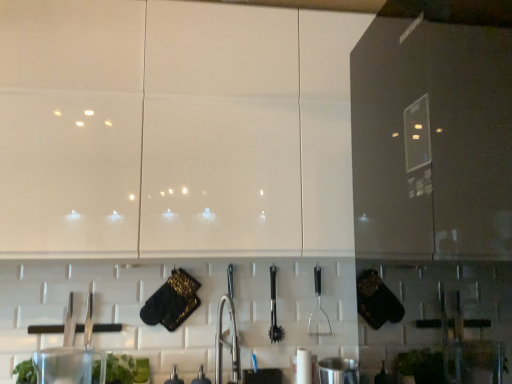
Identify the location of metallic faucet at center, the 2th appliance when ordered from right to left. (201, 377).

The width and height of the screenshot is (512, 384). What do you see at coordinates (201, 377) in the screenshot?
I see `metallic faucet at center, the third appliance from the left` at bounding box center [201, 377].

What do you see at coordinates (70, 365) in the screenshot? I see `transparent plastic container at lower left, the 4th appliance viewed from the right` at bounding box center [70, 365].

The width and height of the screenshot is (512, 384). What do you see at coordinates (183, 128) in the screenshot? I see `white glossy cabinet at upper center` at bounding box center [183, 128].

Describe the element at coordinates (338, 371) in the screenshot. I see `stainless steel pot at lower center, the 1th appliance viewed from the right` at that location.

The image size is (512, 384). What do you see at coordinates (319, 311) in the screenshot?
I see `black plastic spatula at center-right, the 2th silverware viewed from the left` at bounding box center [319, 311].

What do you see at coordinates (174, 377) in the screenshot?
I see `metallic silver faucet at center, the 2th appliance in the left-to-right sequence` at bounding box center [174, 377].

Image resolution: width=512 pixels, height=384 pixels. Identify the location of metallic faucet at center, the 2th appliance when ordered from right to left. (201, 377).

Is metallic silver faucet at center, arranged as the 3th appliance when viewed from the right, outside of stainless steel pot at lower center, the 1th appliance viewed from the right?

That's correct, metallic silver faucet at center, arranged as the 3th appliance when viewed from the right, is outside of stainless steel pot at lower center, the 1th appliance viewed from the right.

How many degrees apart are the facing directions of metallic silver faucet at center, arranged as the 3th appliance when viewed from the right, and stainless steel pot at lower center, which ranks as the 4th appliance in left-to-right order?

8.95 degrees separate the facing orientations of metallic silver faucet at center, arranged as the 3th appliance when viewed from the right, and stainless steel pot at lower center, which ranks as the 4th appliance in left-to-right order.

From the image's perspective, is metallic silver faucet at center, arranged as the 3th appliance when viewed from the right, above or below stainless steel pot at lower center, which ranks as the 4th appliance in left-to-right order?

metallic silver faucet at center, arranged as the 3th appliance when viewed from the right, is below stainless steel pot at lower center, which ranks as the 4th appliance in left-to-right order.

Based on the photo, is metallic silver faucet at center, arranged as the 3th appliance when viewed from the right, wider than stainless steel pot at lower center, which ranks as the 4th appliance in left-to-right order?

No.

Is metallic faucet at center, the 2th appliance when ordered from right to left, touching white glossy cabinet at upper center?

No, metallic faucet at center, the 2th appliance when ordered from right to left, is not touching white glossy cabinet at upper center.

From a real-world perspective, count 4th appliances downward from the white glossy cabinet at upper center and point to it. Please provide its 2D coordinates.

[(201, 377)]

From a real-world perspective, is metallic faucet at center, the third appliance from the left, located beneath white glossy cabinet at upper center?

Yes, from a real-world perspective, metallic faucet at center, the third appliance from the left, is beneath white glossy cabinet at upper center.

Based on their positions, is metallic faucet at center, the third appliance from the left, located to the left or right of white glossy cabinet at upper center?

In the image, metallic faucet at center, the third appliance from the left, appears on the left side of white glossy cabinet at upper center.

Considering the relative sizes of green leafy plant at lower left and satin nickel faucet at center in the image provided, is green leafy plant at lower left thinner than satin nickel faucet at center?

Yes.

Between green leafy plant at lower left and satin nickel faucet at center, which one has smaller size?

green leafy plant at lower left.

Which is less distant, (146, 365) or (239, 356)?

The point (146, 365) is more forward.

Where is `faucet that appears on the right of green leafy plant at lower left`? faucet that appears on the right of green leafy plant at lower left is located at coordinates (226, 342).

Is transparent plastic container at lower left, which is the 1th appliance in left-to-right order, at the right side of black plastic spatula at center-right, arranged as the first silverware when viewed from the right?

In fact, transparent plastic container at lower left, which is the 1th appliance in left-to-right order, is to the left of black plastic spatula at center-right, arranged as the first silverware when viewed from the right.

Could you tell me if transparent plastic container at lower left, which is the 1th appliance in left-to-right order, is facing black plastic spatula at center-right, arranged as the first silverware when viewed from the right?

No, transparent plastic container at lower left, which is the 1th appliance in left-to-right order, is not facing towards black plastic spatula at center-right, arranged as the first silverware when viewed from the right.

Is transparent plastic container at lower left, the 4th appliance viewed from the right, placed right next to black plastic spatula at center-right, arranged as the first silverware when viewed from the right?

A: They are not placed beside each other.

Is polished metal tongs at center, acting as the 1th silverware starting from the left, at the right side of transparent plastic container at lower left, the 4th appliance viewed from the right?

Correct, you'll find polished metal tongs at center, acting as the 1th silverware starting from the left, to the right of transparent plastic container at lower left, the 4th appliance viewed from the right.

Looking at this image, which object is thinner, polished metal tongs at center, acting as the 1th silverware starting from the left, or transparent plastic container at lower left, the 4th appliance viewed from the right?

With smaller width is polished metal tongs at center, acting as the 1th silverware starting from the left.

How far apart are polished metal tongs at center, arranged as the 2th silverware when viewed from the right, and transparent plastic container at lower left, which is the 1th appliance in left-to-right order?

They are 32.07 inches apart.

Is transparent plastic container at lower left, the 4th appliance viewed from the right, inside polished metal tongs at center, arranged as the 2th silverware when viewed from the right?

No, polished metal tongs at center, arranged as the 2th silverware when viewed from the right, does not contain transparent plastic container at lower left, the 4th appliance viewed from the right.

Is black plastic spatula at center-right, the 2th silverware viewed from the left, looking in the opposite direction of metallic silver faucet at center, the 2th appliance in the left-to-right sequence?

No.

Is black plastic spatula at center-right, arranged as the first silverware when viewed from the right, spatially inside metallic silver faucet at center, the 2th appliance in the left-to-right sequence, or outside of it?

black plastic spatula at center-right, arranged as the first silverware when viewed from the right, is not enclosed by metallic silver faucet at center, the 2th appliance in the left-to-right sequence.

Based on the photo, which is nearer, (318, 297) or (176, 371)?

The point (176, 371) is in front.

From the picture: From a real-world perspective, who is located higher, black plastic spatula at center-right, the 2th silverware viewed from the left, or metallic silver faucet at center, arranged as the 3th appliance when viewed from the right?

In real-world perspective, black plastic spatula at center-right, the 2th silverware viewed from the left, is above.

Visually, is metallic silver faucet at center, arranged as the 3th appliance when viewed from the right, positioned to the left or to the right of black plastic spatula at center-right, the 2th silverware viewed from the left?

In the image, metallic silver faucet at center, arranged as the 3th appliance when viewed from the right, appears on the left side of black plastic spatula at center-right, the 2th silverware viewed from the left.

How much distance is there between metallic silver faucet at center, the 2th appliance in the left-to-right sequence, and black plastic spatula at center-right, the 2th silverware viewed from the left?

A distance of 26.24 inches exists between metallic silver faucet at center, the 2th appliance in the left-to-right sequence, and black plastic spatula at center-right, the 2th silverware viewed from the left.

Is metallic silver faucet at center, arranged as the 3th appliance when viewed from the right, placed right next to black plastic spatula at center-right, arranged as the first silverware when viewed from the right?

metallic silver faucet at center, arranged as the 3th appliance when viewed from the right, is not next to black plastic spatula at center-right, arranged as the first silverware when viewed from the right, and they're not touching.

Is metallic silver faucet at center, arranged as the 3th appliance when viewed from the right, wider than black plastic spatula at center-right, arranged as the first silverware when viewed from the right?

Yes, metallic silver faucet at center, arranged as the 3th appliance when viewed from the right, is wider than black plastic spatula at center-right, arranged as the first silverware when viewed from the right.

Which appliance is the 2nd one when counting from the back of the stainless steel pot at lower center, the 1th appliance viewed from the right? Please provide its 2D coordinates.

[(174, 377)]

The height and width of the screenshot is (384, 512). I want to click on cabinetry above the metallic faucet at center, the third appliance from the left (from the image's perspective), so (183, 128).

When comparing their distances from transparent plastic container at lower left, the 4th appliance viewed from the right, does metallic silver faucet at center, the 2th appliance in the left-to-right sequence, or polished metal tongs at center, arranged as the 2th silverware when viewed from the right, seem further?

polished metal tongs at center, arranged as the 2th silverware when viewed from the right, is further to transparent plastic container at lower left, the 4th appliance viewed from the right.

From the image, which object appears to be farther from satin nickel faucet at center, transparent plastic container at lower left, the 4th appliance viewed from the right, or black plastic spatula at center-right, arranged as the first silverware when viewed from the right?

Based on the image, transparent plastic container at lower left, the 4th appliance viewed from the right, appears to be further to satin nickel faucet at center.

Estimate the real-world distances between objects in this image. Which object is closer to polished metal tongs at center, arranged as the 2th silverware when viewed from the right, transparent plastic container at lower left, the 4th appliance viewed from the right, or satin nickel faucet at center?

Among the two, satin nickel faucet at center is located nearer to polished metal tongs at center, arranged as the 2th silverware when viewed from the right.

Considering their positions, is metallic faucet at center, the third appliance from the left, positioned further to satin nickel faucet at center than green leafy plant at lower left?

The object further to satin nickel faucet at center is green leafy plant at lower left.

When comparing their distances from metallic silver faucet at center, the 2th appliance in the left-to-right sequence, does polished metal tongs at center, acting as the 1th silverware starting from the left, or transparent plastic container at lower left, the 4th appliance viewed from the right, seem closer?

Based on the image, transparent plastic container at lower left, the 4th appliance viewed from the right, appears to be nearer to metallic silver faucet at center, the 2th appliance in the left-to-right sequence.

Looking at the image, which one is located further to white glossy cabinet at upper center, green leafy plant at lower left or metallic faucet at center, the third appliance from the left?

metallic faucet at center, the third appliance from the left.

Considering their positions, is metallic faucet at center, the 2th appliance when ordered from right to left, positioned closer to black plastic spatula at center-right, the 2th silverware viewed from the left, than transparent plastic container at lower left, the 4th appliance viewed from the right?

metallic faucet at center, the 2th appliance when ordered from right to left, is closer to black plastic spatula at center-right, the 2th silverware viewed from the left.

Estimate the real-world distances between objects in this image. Which object is closer to transparent plastic container at lower left, the 4th appliance viewed from the right, satin nickel faucet at center or metallic silver faucet at center, the 2th appliance in the left-to-right sequence?

Among the two, metallic silver faucet at center, the 2th appliance in the left-to-right sequence, is located nearer to transparent plastic container at lower left, the 4th appliance viewed from the right.

Locate an element on the screen. This screenshot has width=512, height=384. appliance between white glossy cabinet at upper center and stainless steel pot at lower center, which ranks as the 4th appliance in left-to-right order, in the vertical direction is located at coordinates (70, 365).

Find the location of a particular element. This screenshot has height=384, width=512. faucet between transparent plastic container at lower left, which is the 1th appliance in left-to-right order, and stainless steel pot at lower center, the 1th appliance viewed from the right is located at coordinates (226, 342).

Where is `silverware between transparent plastic container at lower left, which is the 1th appliance in left-to-right order, and black plastic spatula at center-right, arranged as the first silverware when viewed from the right, in the horizontal direction`? Image resolution: width=512 pixels, height=384 pixels. silverware between transparent plastic container at lower left, which is the 1th appliance in left-to-right order, and black plastic spatula at center-right, arranged as the first silverware when viewed from the right, in the horizontal direction is located at coordinates (274, 311).

Locate an element on the screen. The image size is (512, 384). plant that lies between white glossy cabinet at upper center and metallic silver faucet at center, arranged as the 3th appliance when viewed from the right, from top to bottom is located at coordinates (126, 369).